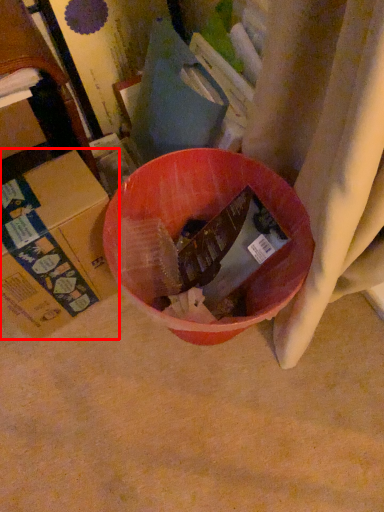
Question: From the image's perspective, considering the relative positions of cardboard box (annotated by the red box) and cardboard box in the image provided, where is cardboard box (annotated by the red box) located with respect to the staircase?

Choices:
 (A) above
 (B) below

Answer: (B)